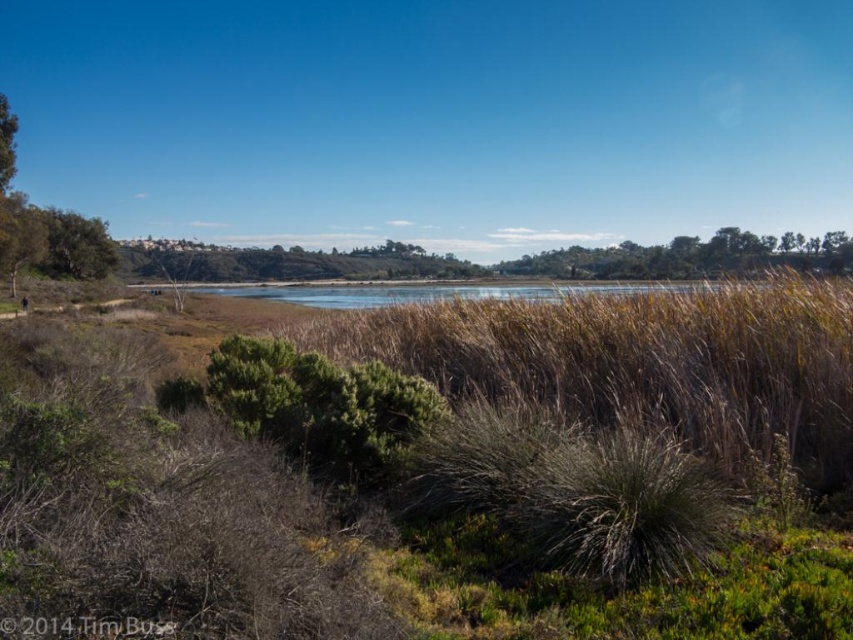
Question: Which of these objects is positioned closest to the brown grass at center?

Choices:
 (A) green leafy tree at left
 (B) brown dry grass at center

Answer: (B)

Question: Which object is positioned closest to the green leafy tree at left?

Choices:
 (A) brown dry grass at center
 (B) brown grass at center

Answer: (A)

Question: Can you confirm if brown grass at center is bigger than green leafy tree at left?

Choices:
 (A) yes
 (B) no

Answer: (B)

Question: Can you confirm if brown dry grass at center is thinner than brown grass at center?

Choices:
 (A) yes
 (B) no

Answer: (B)

Question: Which object is the closest to the green leafy tree at left?

Choices:
 (A) brown grass at center
 (B) brown dry grass at center

Answer: (B)

Question: From the image, what is the correct spatial relationship of brown dry grass at center in relation to brown grass at center?

Choices:
 (A) below
 (B) above

Answer: (A)